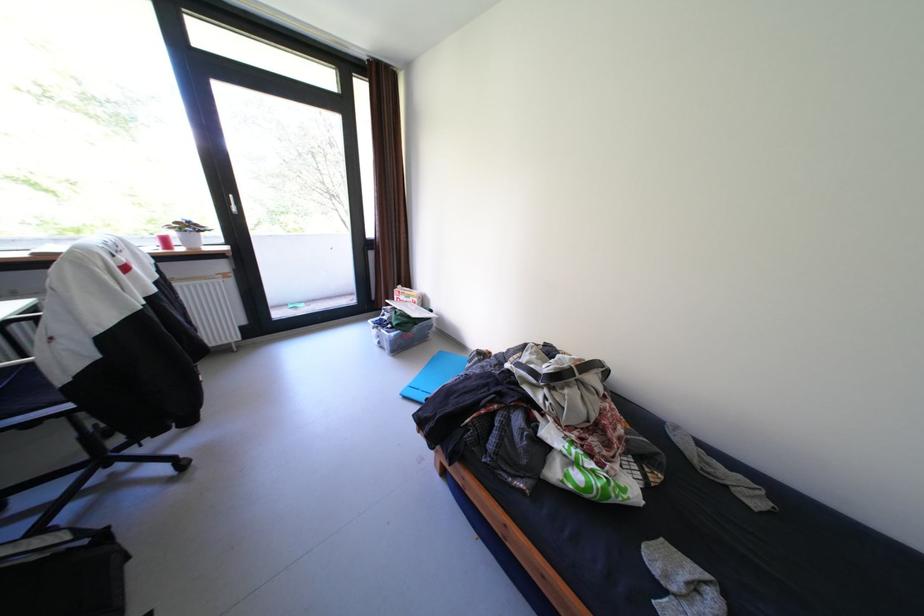
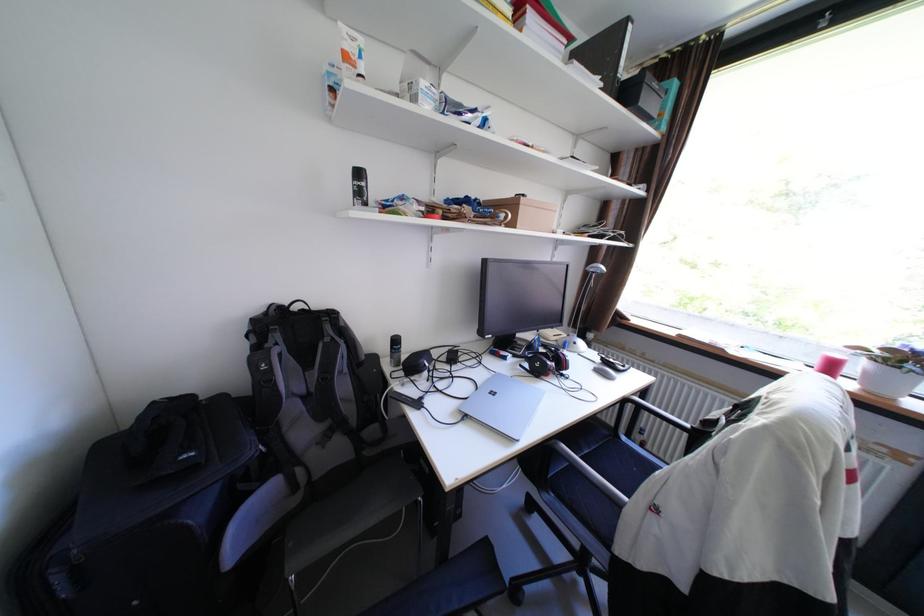
Question: The camera is either moving clockwise (left) or counter-clockwise (right) around the object. The first image is from the beginning of the video and the second image is from the end. Is the camera moving left or right when shooting the video?

Choices:
 (A) Left
 (B) Right

Answer: (B)